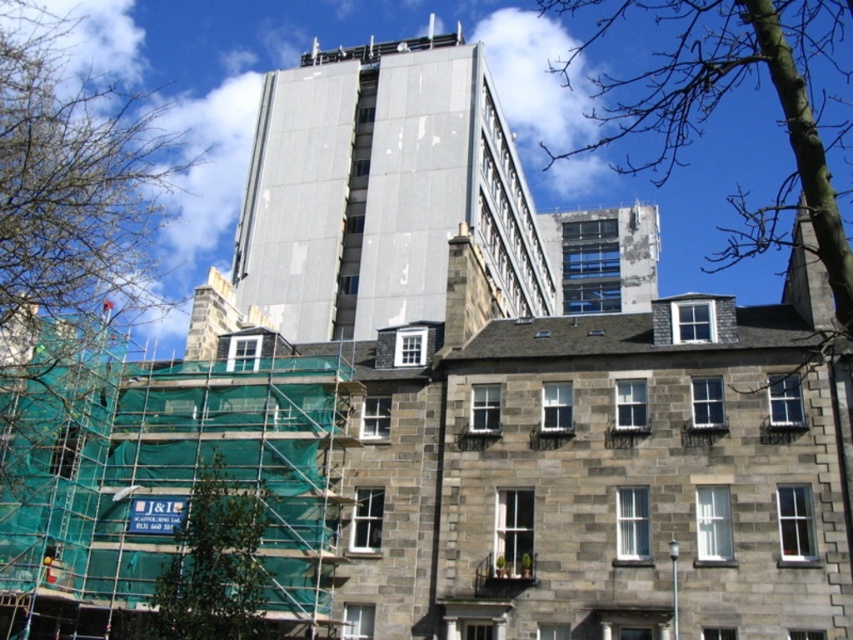
The width and height of the screenshot is (853, 640). What are the coordinates of `silver metallic building at center` in the screenshot? It's located at (381, 189).

Does silver metallic building at center appear on the right side of green leafy tree at left?

Yes, silver metallic building at center is to the right of green leafy tree at left.

Between point (398, 173) and point (84, 147), which one is positioned in front?

Positioned in front is point (84, 147).

I want to click on silver metallic building at center, so pyautogui.click(x=381, y=189).

Is silver metallic building at center shorter than bare wood tree at upper right?

Yes, silver metallic building at center is shorter than bare wood tree at upper right.

Is silver metallic building at center smaller than bare wood tree at upper right?

Indeed, silver metallic building at center has a smaller size compared to bare wood tree at upper right.

Which is behind, point (292, 205) or point (706, 28)?

Point (706, 28)

At what (x,y) coordinates should I click in order to perform the action: click on silver metallic building at center. Please return your answer as a coordinate pair (x, y). Looking at the image, I should click on coord(381,189).

Does bare wood tree at upper right appear under green leafy tree at lower left?

No.

Can you confirm if bare wood tree at upper right is taller than green leafy tree at lower left?

Indeed, bare wood tree at upper right has a greater height compared to green leafy tree at lower left.

Between point (734, 228) and point (222, 625), which one is positioned behind?

Point (734, 228)

In order to click on bare wood tree at upper right in this screenshot , I will do `click(718, 104)`.